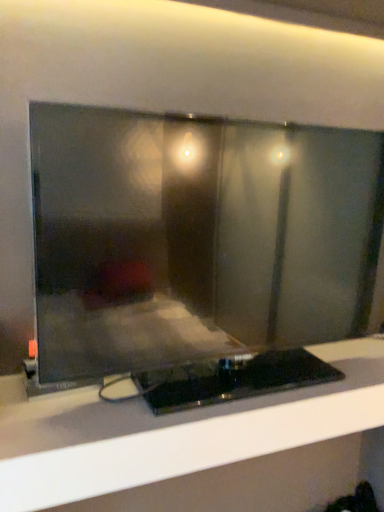
Locate an element on the screen. Image resolution: width=384 pixels, height=512 pixels. vacant space situated above black glossy tv stand at center (from a real-world perspective) is located at coordinates (243, 380).